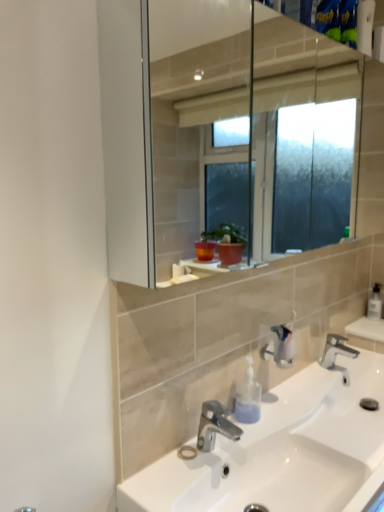
Identify the location of free point to the right of translucent plastic soap dispenser at lower center, the first soap dispenser when ordered from front to back. The width and height of the screenshot is (384, 512). (302, 423).